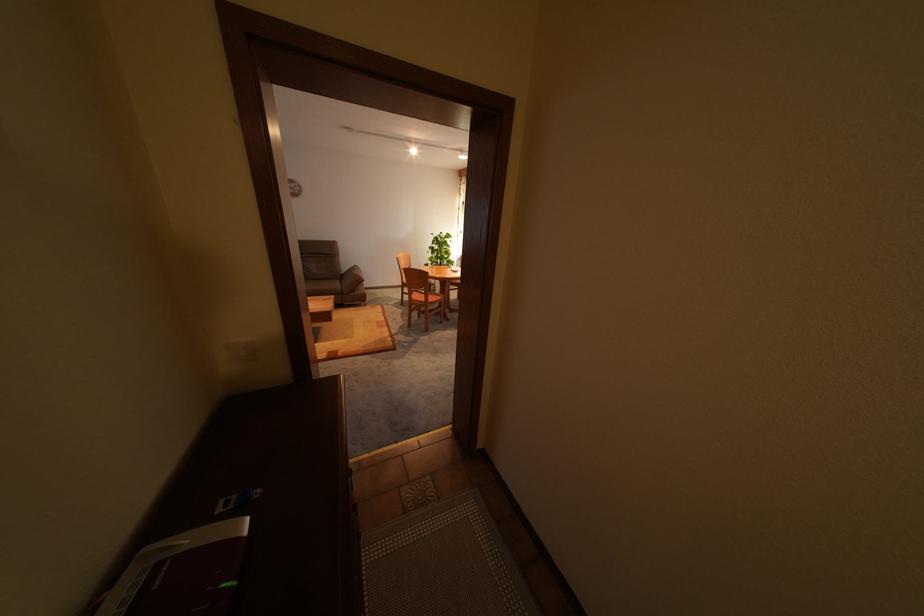
This screenshot has height=616, width=924. What do you see at coordinates (424, 297) in the screenshot?
I see `the wooden chair sitting surface` at bounding box center [424, 297].